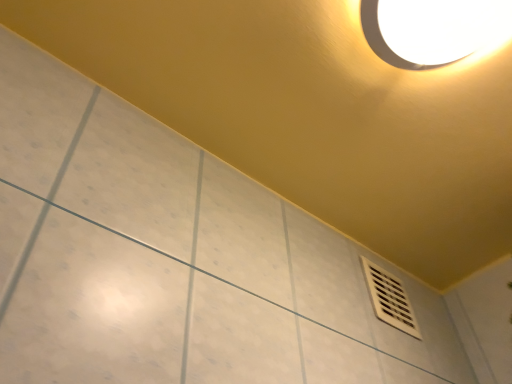
The height and width of the screenshot is (384, 512). I want to click on white plastic vent at lower right, so click(390, 299).

This screenshot has height=384, width=512. What do you see at coordinates (390, 299) in the screenshot?
I see `white plastic vent at lower right` at bounding box center [390, 299].

Image resolution: width=512 pixels, height=384 pixels. In order to click on white plastic vent at lower right in this screenshot , I will do `click(390, 299)`.